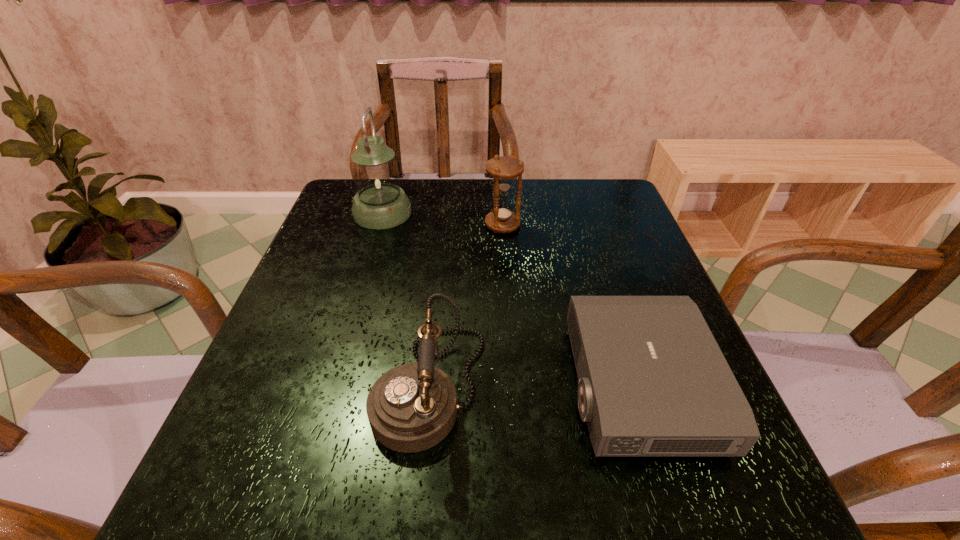
At what (x,y) coordinates should I click in order to perform the action: click on vacant region at the near edge of the desktop. Please return your answer as a coordinate pair (x, y). Looking at the image, I should click on (565, 488).

In the image, there is a desktop. Identify the location of free space at the left edge. The height and width of the screenshot is (540, 960). (335, 389).

In the image, there is a desktop. At what (x,y) coordinates should I click in order to perform the action: click on free space at the right edge. Please return your answer as a coordinate pair (x, y). The width and height of the screenshot is (960, 540). Looking at the image, I should click on (667, 458).

The height and width of the screenshot is (540, 960). In the image, there is a desktop. In order to click on vacant space at the far left corner in this screenshot , I will do `click(348, 205)`.

The height and width of the screenshot is (540, 960). I want to click on vacant position at the far right corner of the desktop, so click(x=610, y=185).

The width and height of the screenshot is (960, 540). In the image, there is a desktop. In order to click on free space at the near right corner in this screenshot , I will do `click(692, 487)`.

Image resolution: width=960 pixels, height=540 pixels. Find the location of `free space between the leftmost object and the telephone`. free space between the leftmost object and the telephone is located at coordinates (406, 300).

Locate an element on the screen. vacant space that's between the telephone and the projector is located at coordinates (534, 386).

Identify the location of free space that is in between the shortest object and the telephone. This screenshot has width=960, height=540. (534, 386).

At what (x,y) coordinates should I click in order to perform the action: click on empty location between the tallest object and the telephone. Please return your answer as a coordinate pair (x, y). Looking at the image, I should click on (406, 300).